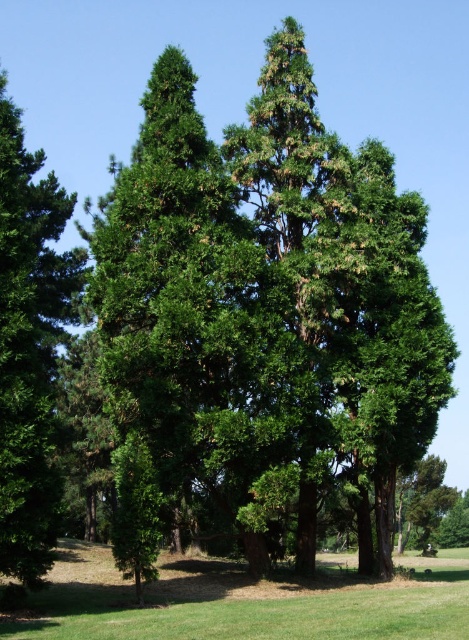
Question: Which object is closer to the camera taking this photo?

Choices:
 (A) green grassy field at lower center
 (B) green leafy tree at center
 (C) green leafy tree at left

Answer: (A)

Question: Can you confirm if green grassy field at lower center is smaller than green leafy tree at left?

Choices:
 (A) yes
 (B) no

Answer: (B)

Question: Can you confirm if green grassy field at lower center is positioned to the right of green leafy tree at left?

Choices:
 (A) no
 (B) yes

Answer: (B)

Question: Estimate the real-world distances between objects in this image. Which object is closer to the green leafy tree at center?

Choices:
 (A) green grassy field at lower center
 (B) green leafy tree at left

Answer: (B)

Question: Does green grassy field at lower center appear over green leafy tree at left?

Choices:
 (A) yes
 (B) no

Answer: (B)

Question: Which object is positioned farthest from the green leafy tree at center?

Choices:
 (A) green grassy field at lower center
 (B) green leafy tree at left

Answer: (A)